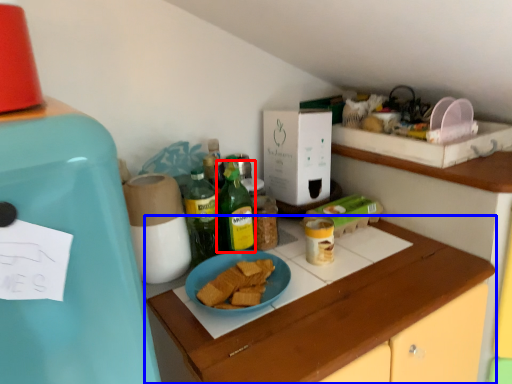
Question: Which of the following is the farthest to the observer, bottle (highlighted by a red box) or cabinetry (highlighted by a blue box)?

Choices:
 (A) bottle
 (B) cabinetry

Answer: (A)